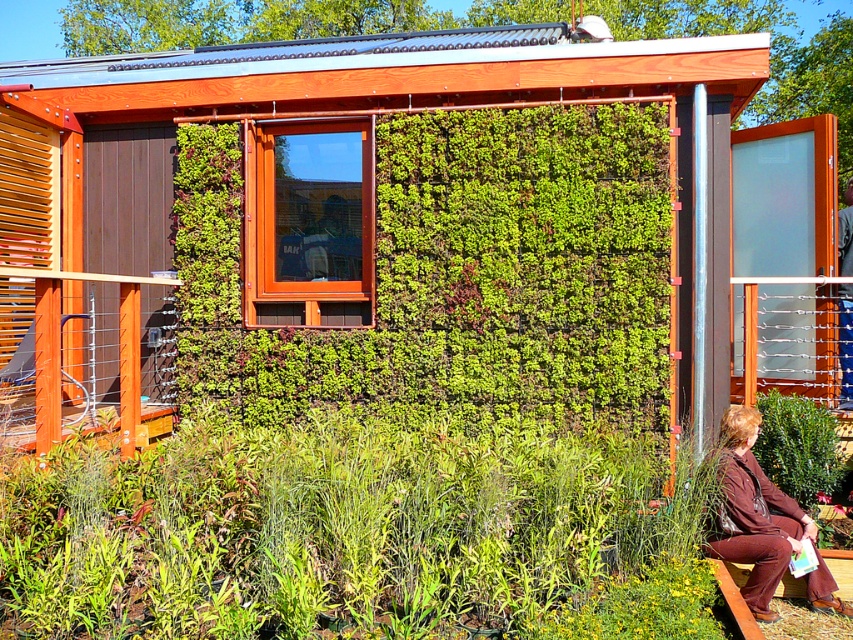
Between green leafy hedge at center and brown fabric at lower right, which one has less height?

With less height is brown fabric at lower right.

Can you confirm if green leafy hedge at center is taller than brown fabric at lower right?

Indeed, green leafy hedge at center has a greater height compared to brown fabric at lower right.

Measure the distance between green leafy hedge at center and camera.

green leafy hedge at center is 20.08 feet away from camera.

Locate an element on the screen. green leafy hedge at center is located at coordinates (456, 273).